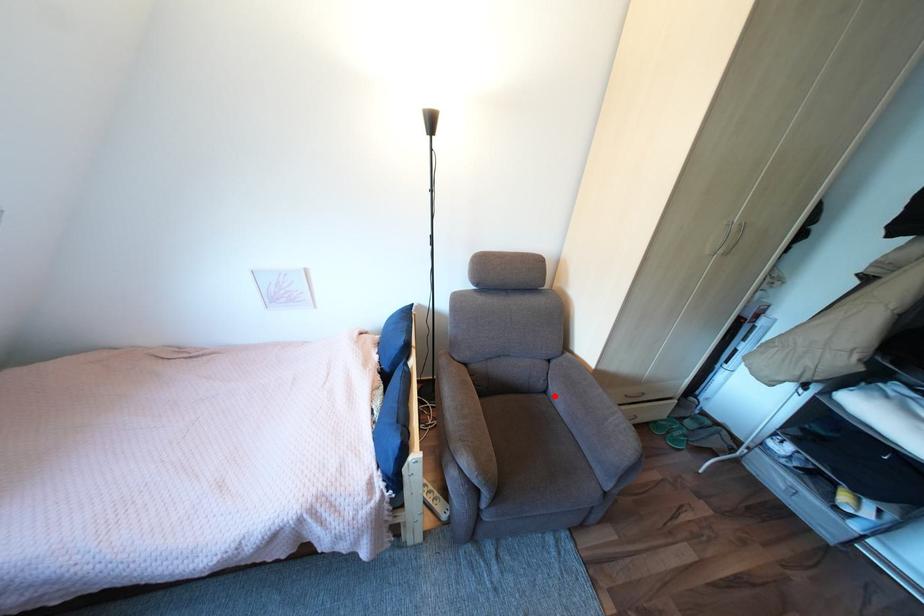
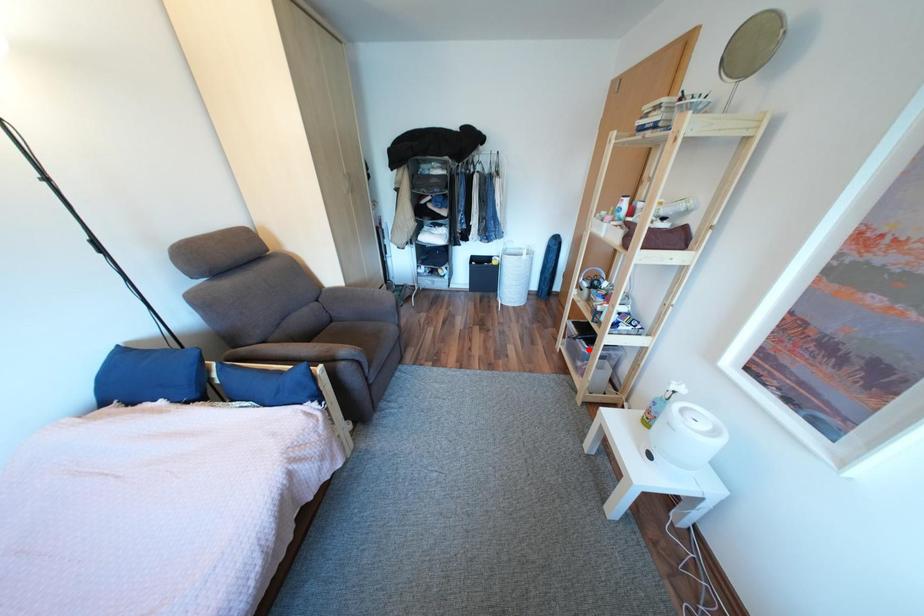
I am providing you with two images of the same scene from different viewpoints. A red point is marked on the first image and another point is marked on the second image. Are the points marked in image1 and image2 representing the same 3D position?

No